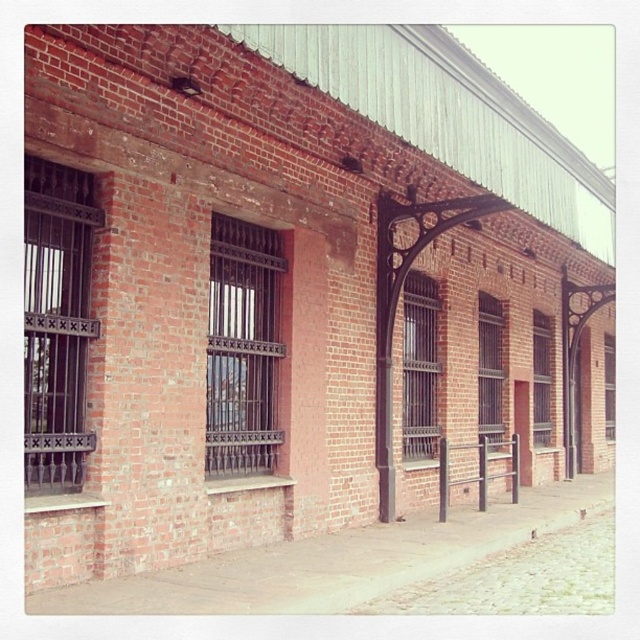
You are an architect analyzing the building facade. You notice a point marked at coordinates (x=243, y=348). Which object on the facade does this point correspond to?

The point at coordinates (x=243, y=348) corresponds to the dark brown wrought iron window at center.

You are a painter standing 4 meters away from the dark brown wrought iron window at center. You need to paint the dark brown metal bars at center, which are 3.99 meters away from the window. Can you reach the metal bars from your current position without moving closer?

The dark brown metal bars at center are 3.99 meters away from the dark brown wrought iron window at center. Since you are already 4 meters away from the window, the total distance to the metal bars would be 4 meters minus 3.99 meters, which is 0.01 meters. This means you are almost at the same position as the metal bars and can easily reach them without needing to move closer.